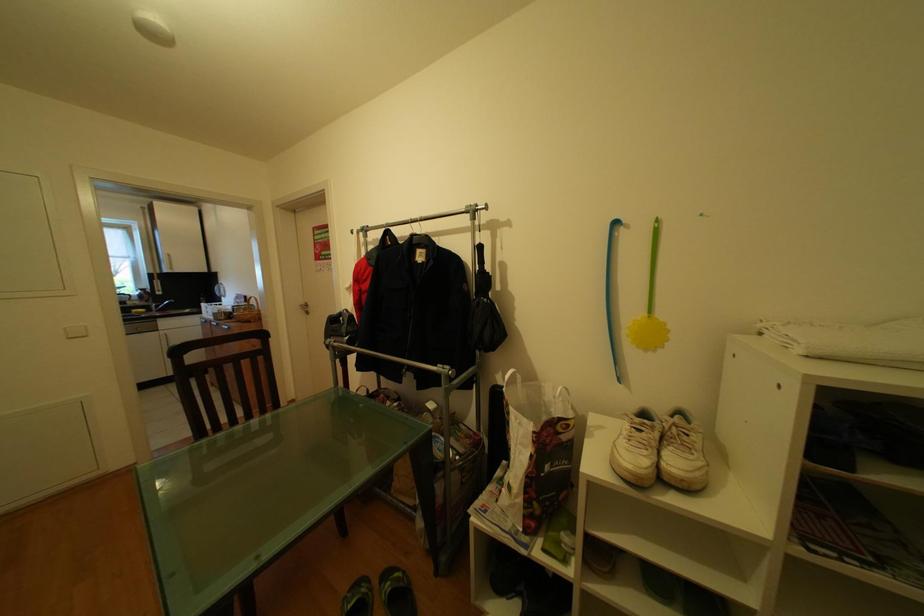
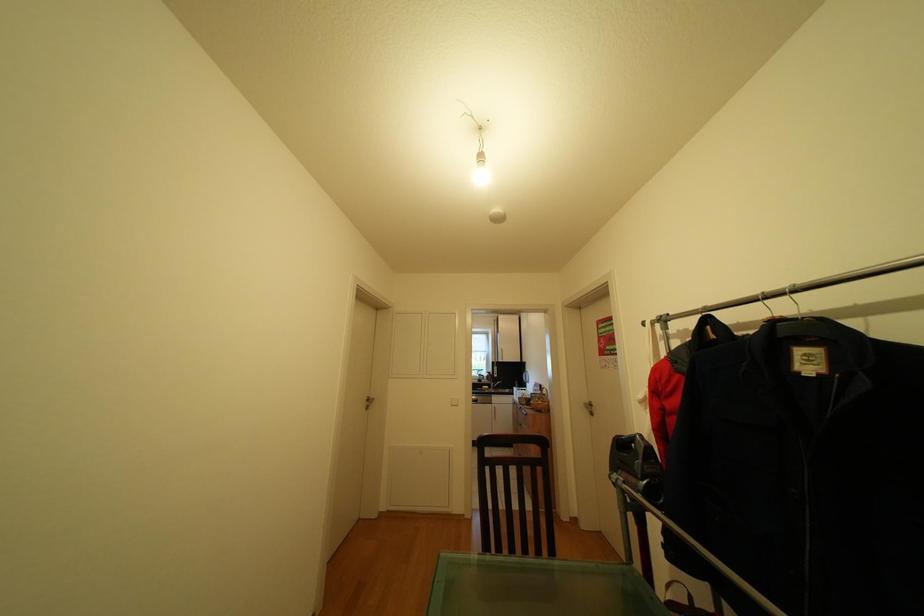
The first image is from the beginning of the video and the second image is from the end. How did the camera likely rotate when shooting the video?

The rotation direction of the camera is left-up.